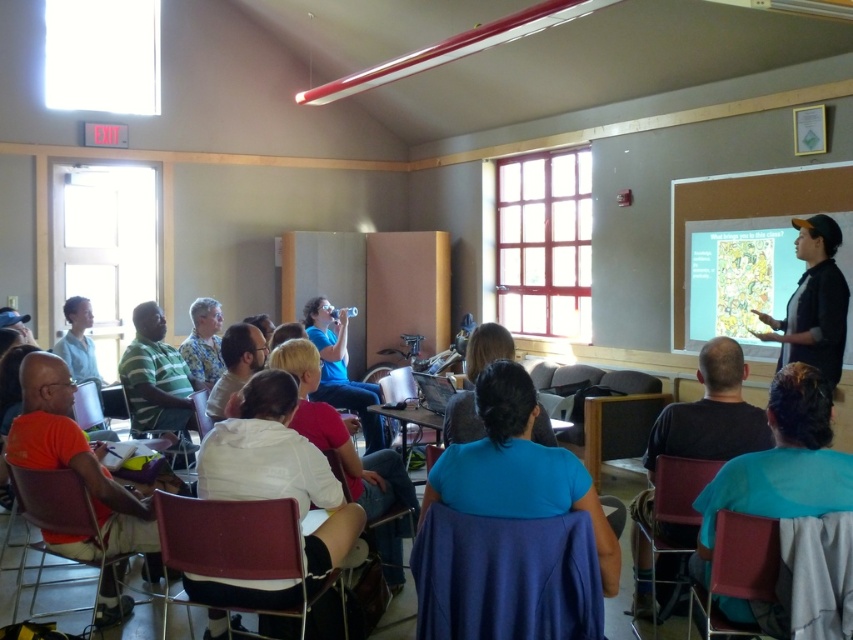
You are standing in the classroom and notice a point at coordinates [790,513]. What object in the classroom is located at this point?

The point at coordinates [790,513] corresponds to the blue fabric shirt at lower right.

You are standing at the entrance of the classroom and see the dark blue shirt at lower center. Can you estimate how far it is from the front of the room?

The dark blue shirt at lower center is located at point (694, 451), which means it is approximately 0.815 meters away from the front of the room.

You are organizing a classroom activity and need to seat two students next to each other. You have an orange matte shirt at lower left and a light blue shirt at lower left. Which student wearing one of these shirts should you place on the left side to ensure they have enough space between them?

The orange matte shirt at lower left is thinner than the light blue shirt at lower left, so placing the orange matte shirt at lower left on the left side would allow more space between them.